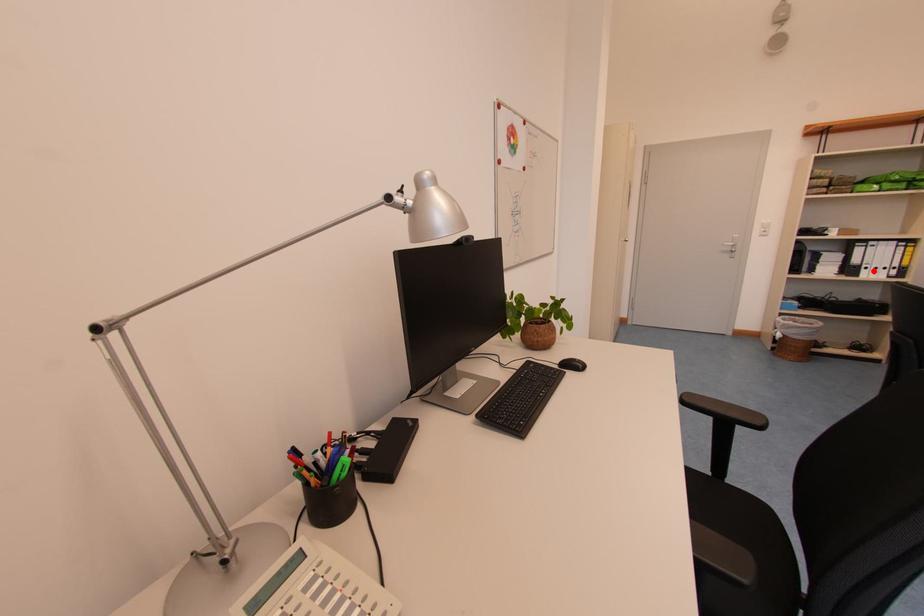
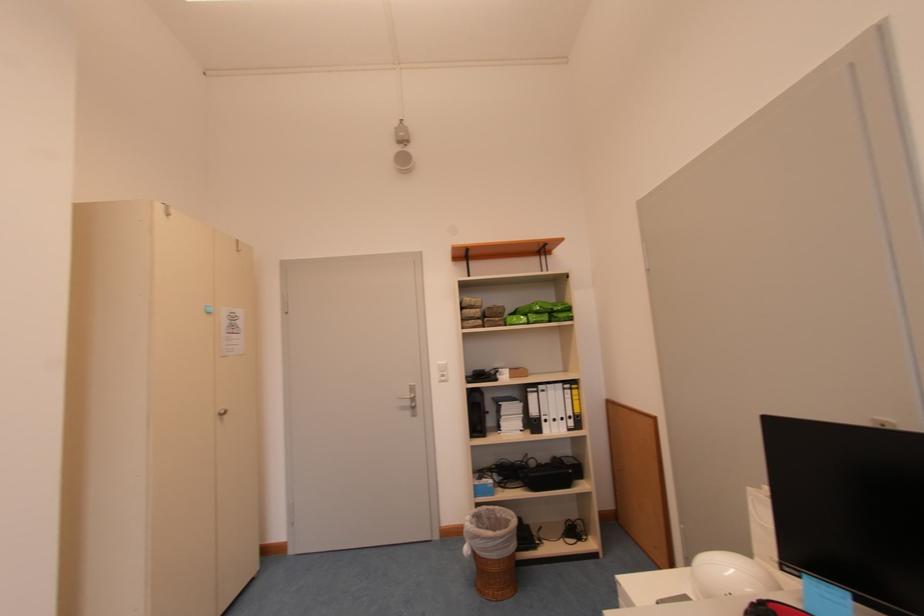
Where in the second image is the point corresponding to the highlighted location from the first image?

(553, 424)